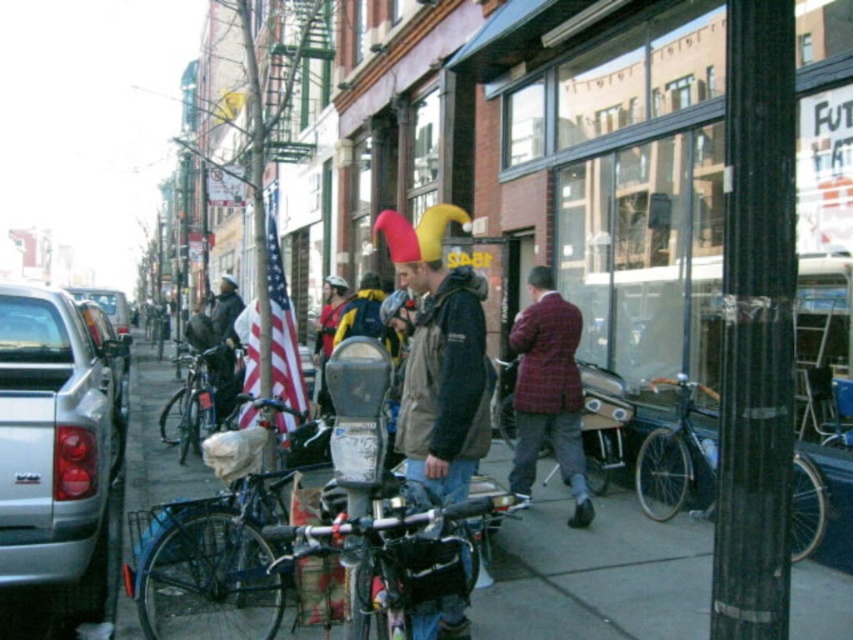
Question: Which of the following is the closest to the observer?

Choices:
 (A) smooth concrete sidewalk at center
 (B) shiny black bicycle at center

Answer: (A)

Question: Does smooth concrete sidewalk at center come in front of plaid wool jacket at center?

Choices:
 (A) yes
 (B) no

Answer: (A)

Question: Can you confirm if black plastic pole at center is thinner than smooth concrete sidewalk at center?

Choices:
 (A) yes
 (B) no

Answer: (A)

Question: Which point is farther from the camera taking this photo?

Choices:
 (A) (764, 424)
 (B) (643, 506)

Answer: (B)

Question: Does american flag at center have a greater width compared to metallic silver bicycle at center?

Choices:
 (A) yes
 (B) no

Answer: (A)

Question: Which point appears closest to the camera in this image?

Choices:
 (A) (511, 436)
 (B) (786, 278)

Answer: (B)